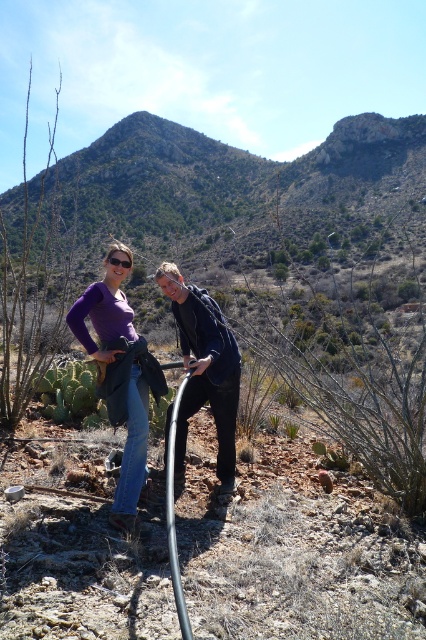
Between black matte jacket at center and matte purple shirt at center, which one has less height?

With less height is black matte jacket at center.

Which is more to the left, black matte jacket at center or matte purple shirt at center?

From the viewer's perspective, matte purple shirt at center appears more on the left side.

Does point (207, 358) lie in front of point (132, 452)?

No, (207, 358) is behind (132, 452).

This screenshot has height=640, width=426. What are the coordinates of `black matte jacket at center` in the screenshot? It's located at [x=204, y=369].